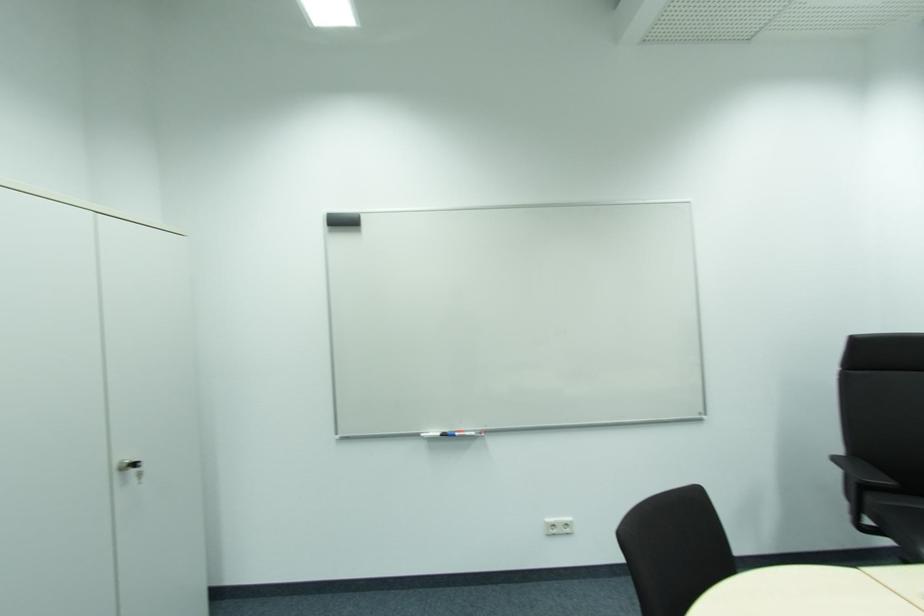
Which object does [453,434] point to?

This point indicates the whiteboard marker.